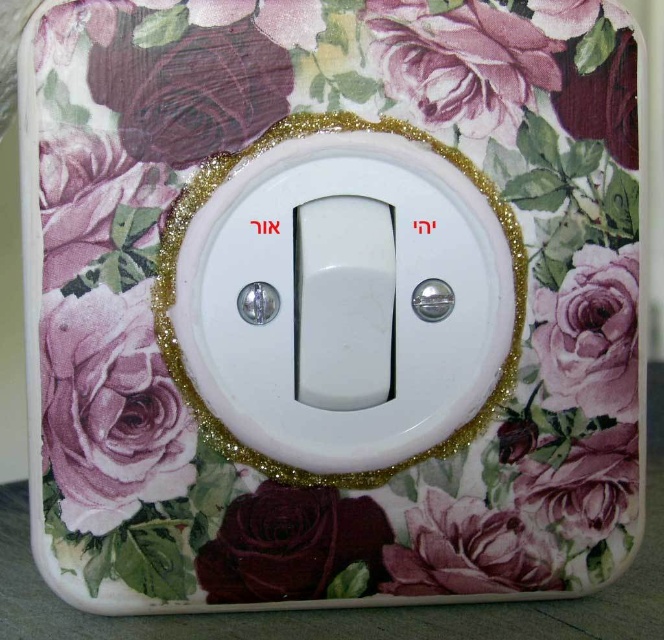
Does matte floral rose at lower left have a lesser width compared to matte floral rose at upper right?

No, matte floral rose at lower left is not thinner than matte floral rose at upper right.

Is point (159, 483) positioned behind point (588, 326)?

No, it is not.

Locate an element on the screen. The width and height of the screenshot is (664, 640). matte floral rose at lower left is located at coordinates (110, 408).

Locate an element on the screen. Image resolution: width=664 pixels, height=640 pixels. matte purple rose at upper left is located at coordinates (191, 90).

Consider the image. Does matte purple rose at upper left lie in front of matte floral rose at upper right?

Yes, matte purple rose at upper left is in front of matte floral rose at upper right.

The image size is (664, 640). What do you see at coordinates (191, 90) in the screenshot?
I see `matte purple rose at upper left` at bounding box center [191, 90].

Image resolution: width=664 pixels, height=640 pixels. What are the coordinates of `matte purple rose at upper left` in the screenshot? It's located at (191, 90).

Does point (183, 474) come behind point (238, 570)?

No, (183, 474) is in front of (238, 570).

Between point (92, 346) and point (226, 508), which one is positioned in front?

Positioned in front is point (92, 346).

Identify the location of matte floral rose at lower left. The width and height of the screenshot is (664, 640). (110, 408).

I want to click on matte floral rose at lower left, so click(x=110, y=408).